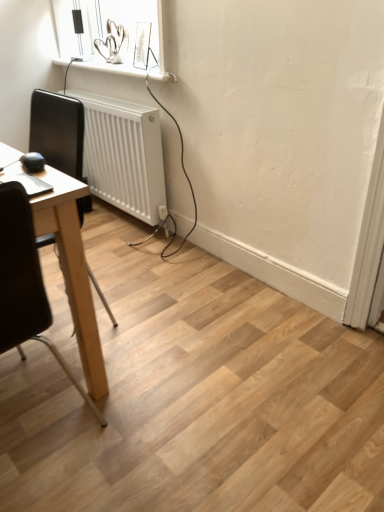
Question: Is black leather chair at left, placed as the 1th chair when sorted from back to front, thinner than black leather chair at left, the second chair positioned from the back?

Choices:
 (A) yes
 (B) no

Answer: (A)

Question: From a real-world perspective, is black leather chair at left, positioned as the second chair in front-to-back order, beneath black leather chair at left, positioned as the first chair in front-to-back order?

Choices:
 (A) yes
 (B) no

Answer: (B)

Question: Would you say black leather chair at left, positioned as the second chair in front-to-back order, is a long distance from black leather chair at left, positioned as the first chair in front-to-back order?

Choices:
 (A) yes
 (B) no

Answer: (A)

Question: Is black leather chair at left, positioned as the second chair in front-to-back order, surrounding black leather chair at left, the second chair positioned from the back?

Choices:
 (A) yes
 (B) no

Answer: (B)

Question: Is black leather chair at left, positioned as the second chair in front-to-back order, at the left side of black leather chair at left, the second chair positioned from the back?

Choices:
 (A) no
 (B) yes

Answer: (B)

Question: In the image, is black leather chair at left, the second chair positioned from the back, positioned in front of or behind black leather chair at left, positioned as the second chair in front-to-back order?

Choices:
 (A) front
 (B) behind

Answer: (A)

Question: Is point coord(1,189) closer or farther from the camera than point coord(39,112)?

Choices:
 (A) farther
 (B) closer

Answer: (B)

Question: From a real-world perspective, is black leather chair at left, positioned as the first chair in front-to-back order, physically located above or below black leather chair at left, placed as the 1th chair when sorted from back to front?

Choices:
 (A) above
 (B) below

Answer: (B)

Question: Considering the relative positions of black leather chair at left, positioned as the first chair in front-to-back order, and black leather chair at left, positioned as the second chair in front-to-back order, in the image provided, is black leather chair at left, positioned as the first chair in front-to-back order, to the left or to the right of black leather chair at left, positioned as the second chair in front-to-back order,?

Choices:
 (A) right
 (B) left

Answer: (A)

Question: In terms of height, does white plastic radiator at lower left look taller or shorter compared to black leather chair at left, the second chair positioned from the back?

Choices:
 (A) tall
 (B) short

Answer: (B)

Question: Considering the positions of point (94, 145) and point (1, 225), is point (94, 145) closer or farther from the camera than point (1, 225)?

Choices:
 (A) closer
 (B) farther

Answer: (B)

Question: Considering the positions of white plastic radiator at lower left and black leather chair at left, the second chair positioned from the back, in the image, is white plastic radiator at lower left wider or thinner than black leather chair at left, the second chair positioned from the back,?

Choices:
 (A) wide
 (B) thin

Answer: (B)

Question: Is white plastic radiator at lower left bigger or smaller than black leather chair at left, positioned as the first chair in front-to-back order?

Choices:
 (A) big
 (B) small

Answer: (B)

Question: Considering the positions of black leather chair at left, positioned as the first chair in front-to-back order, and white plastic radiator at lower left in the image, is black leather chair at left, positioned as the first chair in front-to-back order, taller or shorter than white plastic radiator at lower left?

Choices:
 (A) short
 (B) tall

Answer: (B)

Question: Relative to white plastic radiator at lower left, is black leather chair at left, the second chair positioned from the back, in front or behind?

Choices:
 (A) front
 (B) behind

Answer: (A)